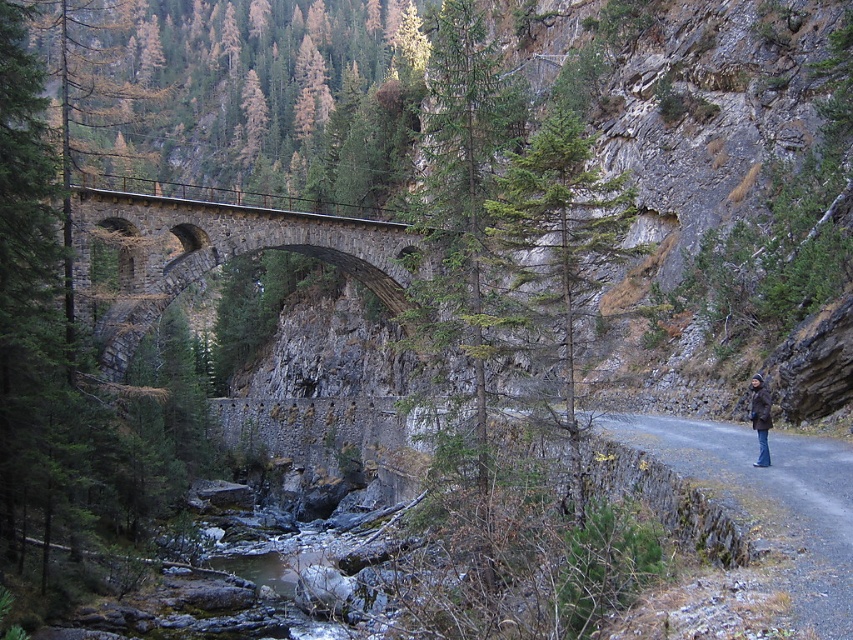
Is stone arch bridge at center bigger than dark brown leather jacket at right?

Yes, stone arch bridge at center is bigger than dark brown leather jacket at right.

Can you confirm if stone arch bridge at center is taller than dark brown leather jacket at right?

Indeed, stone arch bridge at center has a greater height compared to dark brown leather jacket at right.

You are a GUI agent. You are given a task and a screenshot of the screen. Output one action in this format:
    pyautogui.click(x=<x>, y=<y>)
    Task: Click on the stone arch bridge at center
    The image size is (853, 640).
    Given the screenshot: What is the action you would take?
    215,252